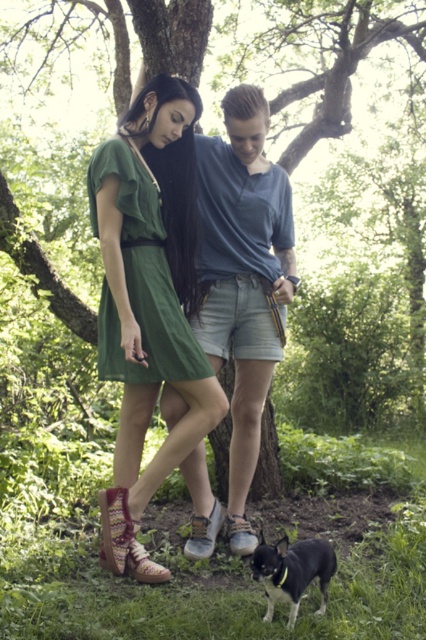
Based on the coordinates provided, can you identify which object in the scene is located at point (149, 301)?

The point (149, 301) corresponds to the green fabric dress at center.

You are a photographer standing in the forest scene. You notice two points marked in the image. The first point is at coordinates point (x=253, y=452) and the second is at point (x=284, y=545). Which point is closer to you?

Point (x=253, y=452) is further to the camera than point (x=284, y=545), so the second point is closer to you.